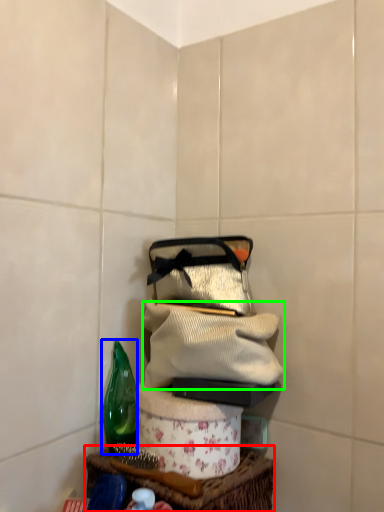
Question: Which object is positioned farthest from table (highlighted by a red box)? Select from bottle (highlighted by a blue box) and clothing (highlighted by a green box).

Choices:
 (A) bottle
 (B) clothing

Answer: (B)